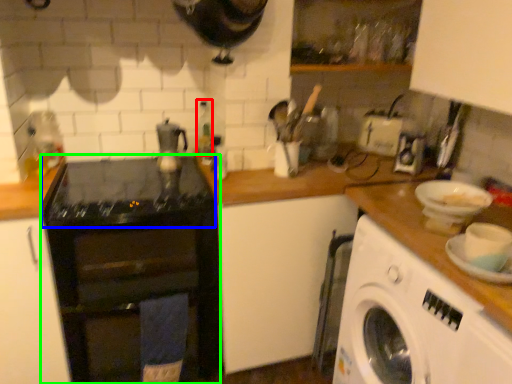
Question: Estimate the real-world distances between objects in this image. Which object is farther from bottle (highlighted by a red box), gas stove (highlighted by a blue box) or home appliance (highlighted by a green box)?

Choices:
 (A) gas stove
 (B) home appliance

Answer: (B)